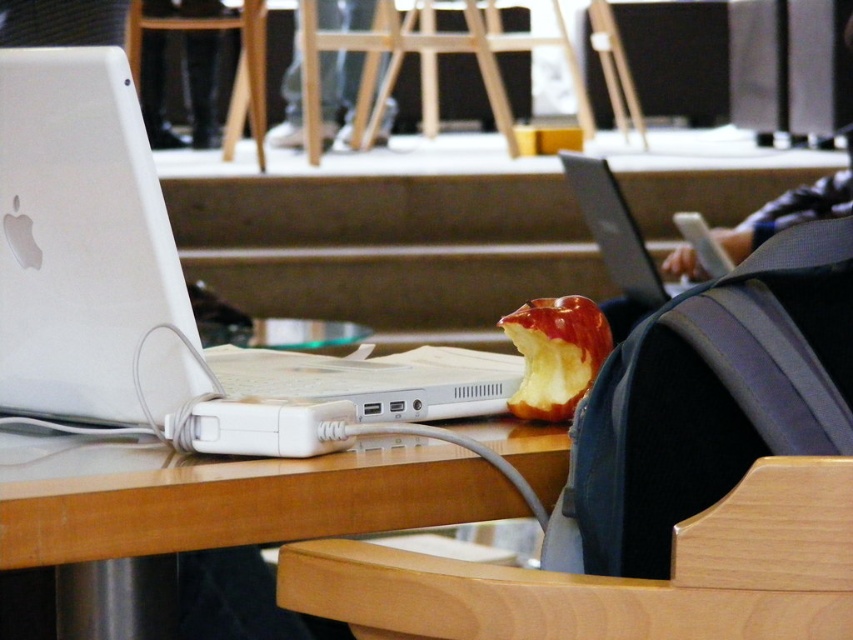
Is white plastic laptop at left further to the viewer compared to silver metallic laptop at center?

No, white plastic laptop at left is in front of silver metallic laptop at center.

Which is more to the left, white plastic laptop at left or silver metallic laptop at center?

From the viewer's perspective, white plastic laptop at left appears more on the left side.

Is point (33, 189) less distant than point (630, 304)?

That is True.

Where is `white plastic laptop at left`? Image resolution: width=853 pixels, height=640 pixels. white plastic laptop at left is located at coordinates (148, 289).

Can you confirm if shiny red apple at center is thinner than dark blue backpack at right?

Yes, shiny red apple at center is thinner than dark blue backpack at right.

At what (x,y) coordinates should I click in order to perform the action: click on shiny red apple at center. Please return your answer as a coordinate pair (x, y). Looking at the image, I should click on (555, 355).

Who is positioned more to the right, wooden chair at lower center or white fabric pants at upper center?

From the viewer's perspective, wooden chair at lower center appears more on the right side.

From the picture: Does wooden chair at lower center appear on the left side of white fabric pants at upper center?

No, wooden chair at lower center is not to the left of white fabric pants at upper center.

Is point (727, 579) in front of point (291, 93)?

Yes.

This screenshot has width=853, height=640. I want to click on wooden chair at lower center, so click(x=616, y=577).